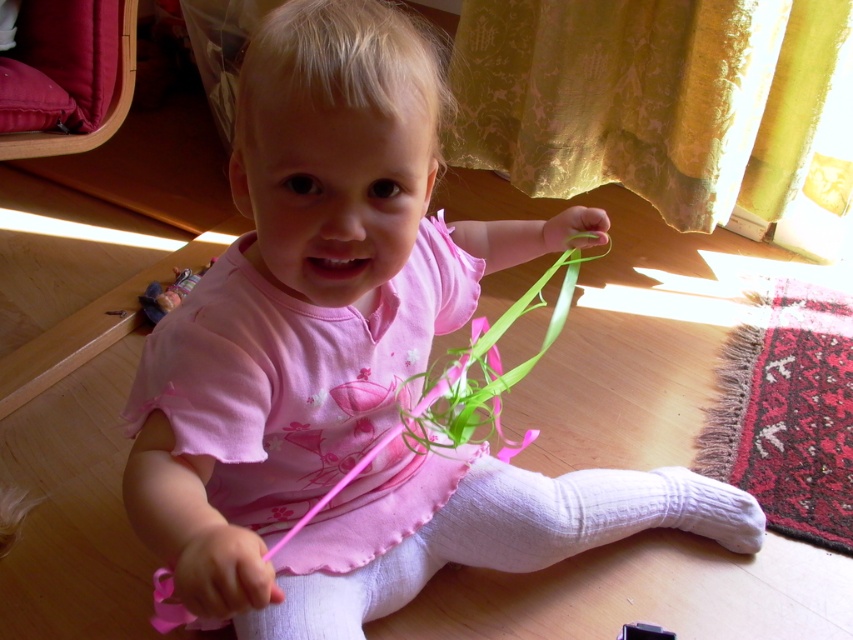
Does point (473, 387) lie in front of point (177, 280)?

Yes, point (473, 387) is closer to viewer.

Is green silky ribbon at center positioned before striped fabric doll at left?

That is True.

Is point (280, 548) behind point (167, 296)?

No, (280, 548) is closer to viewer.

At what (x,y) coordinates should I click in order to perform the action: click on green silky ribbon at center. Please return your answer as a coordinate pair (x, y). This screenshot has height=640, width=853. Looking at the image, I should click on (498, 356).